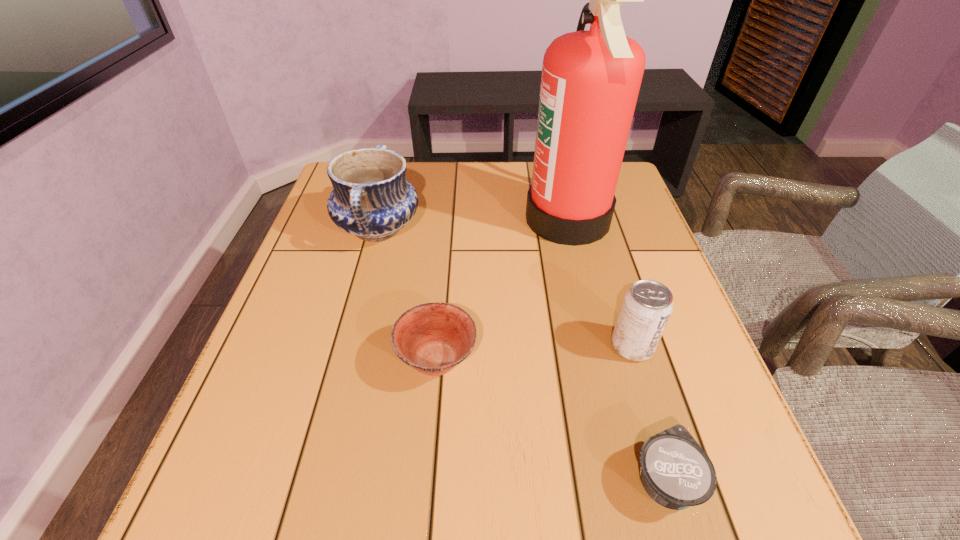
You are a GUI agent. You are given a task and a screenshot of the screen. Output one action in this format:
    pyautogui.click(x=<x>, y=<y>)
    Task: Click on the free region that satisfies the following two spatial constraints: 1. on the back side of the third shortest object; 2. at the nozzle of the fire extinguisher
    
    Given the screenshot: What is the action you would take?
    pyautogui.click(x=593, y=219)

Locate an element on the screen. This screenshot has height=540, width=960. free point that satisfies the following two spatial constraints: 1. on the back side of the nearest object; 2. on the left side of the soda can is located at coordinates (625, 346).

Locate an element on the screen. The height and width of the screenshot is (540, 960). free location that satisfies the following two spatial constraints: 1. at the nozzle of the fire extinguisher; 2. on the back side of the soda can is located at coordinates [x=598, y=346].

Where is `free location that satisfies the following two spatial constraints: 1. at the nozzle of the fire extinguisher; 2. on the front side of the bowl`? This screenshot has width=960, height=540. free location that satisfies the following two spatial constraints: 1. at the nozzle of the fire extinguisher; 2. on the front side of the bowl is located at coordinates (602, 360).